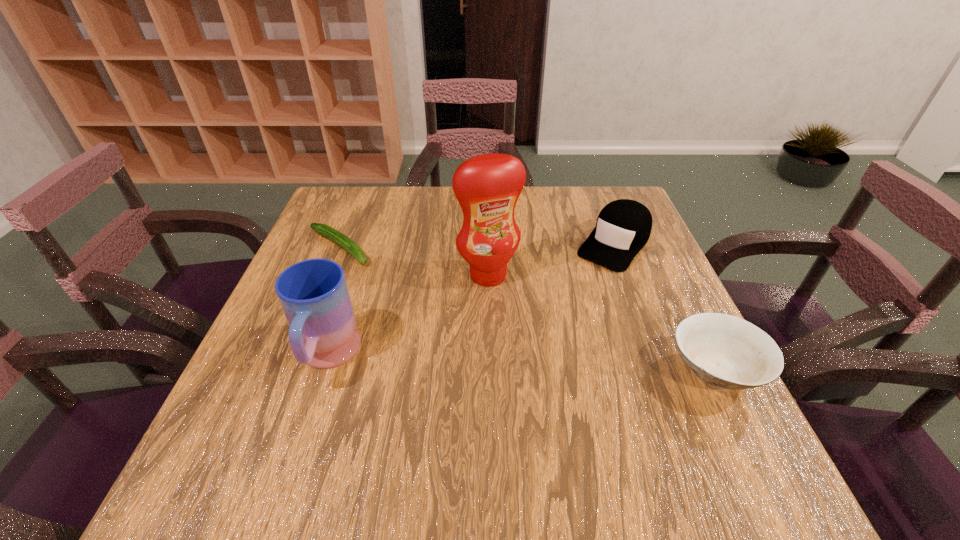
Where is `vacant space at the near edge of the desktop`? vacant space at the near edge of the desktop is located at coordinates (474, 402).

In the image, there is a desktop. Where is `free region at the far left corner`? The height and width of the screenshot is (540, 960). free region at the far left corner is located at coordinates (363, 192).

At what (x,y) coordinates should I click in order to perform the action: click on free region at the near left corner of the desktop. Please return your answer as a coordinate pair (x, y). This screenshot has height=540, width=960. Looking at the image, I should click on (252, 421).

You are a GUI agent. You are given a task and a screenshot of the screen. Output one action in this format:
    pyautogui.click(x=<x>, y=<y>)
    Task: Click on the free space at the far right corner of the desktop
    Image resolution: width=960 pixels, height=540 pixels.
    Given the screenshot: What is the action you would take?
    pyautogui.click(x=585, y=197)

Image resolution: width=960 pixels, height=540 pixels. Identify the location of vacant space at the near right corner. (658, 435).

Identify the location of free spot between the bowl and the shortest object. This screenshot has width=960, height=540. (527, 309).

This screenshot has height=540, width=960. In order to click on empty space that is in between the tallest object and the second shortest object in this screenshot , I will do `click(602, 322)`.

The height and width of the screenshot is (540, 960). Find the location of `vacant area between the third tallest object and the fourth shortest object`. vacant area between the third tallest object and the fourth shortest object is located at coordinates (470, 301).

Find the location of `free spot between the cap and the bowl`. free spot between the cap and the bowl is located at coordinates (664, 307).

The width and height of the screenshot is (960, 540). Find the location of `free spot between the second shortest object and the cap`. free spot between the second shortest object and the cap is located at coordinates (664, 307).